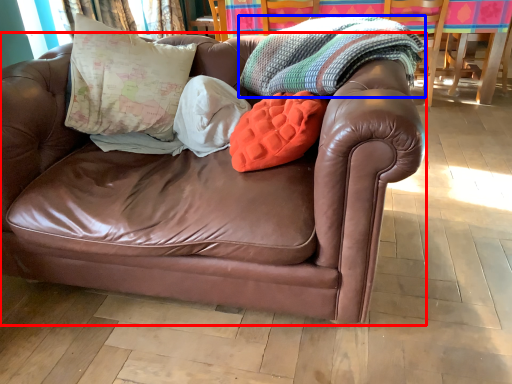
Question: Which point is further to the camera, studio couch (highlighted by a red box) or blanket (highlighted by a blue box)?

Choices:
 (A) studio couch
 (B) blanket

Answer: (B)